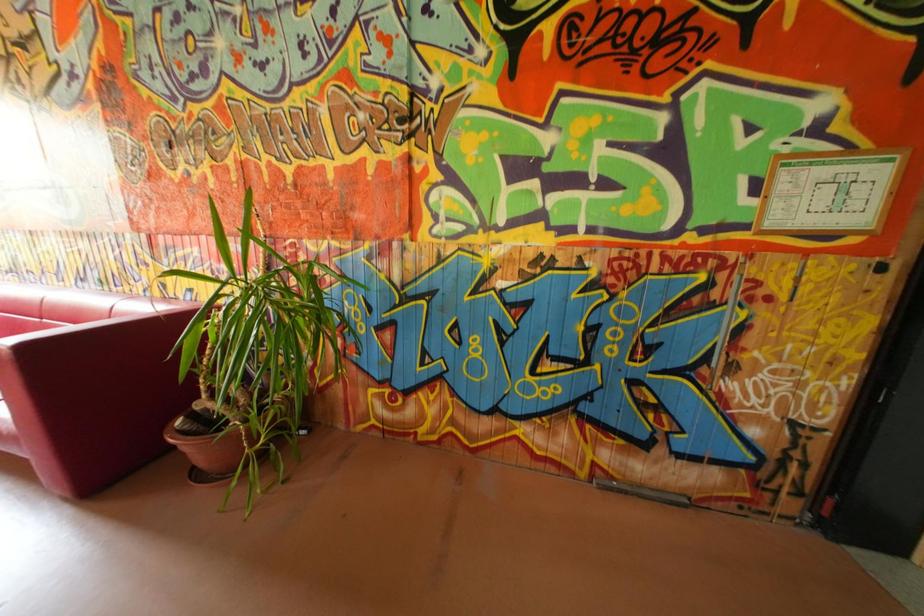
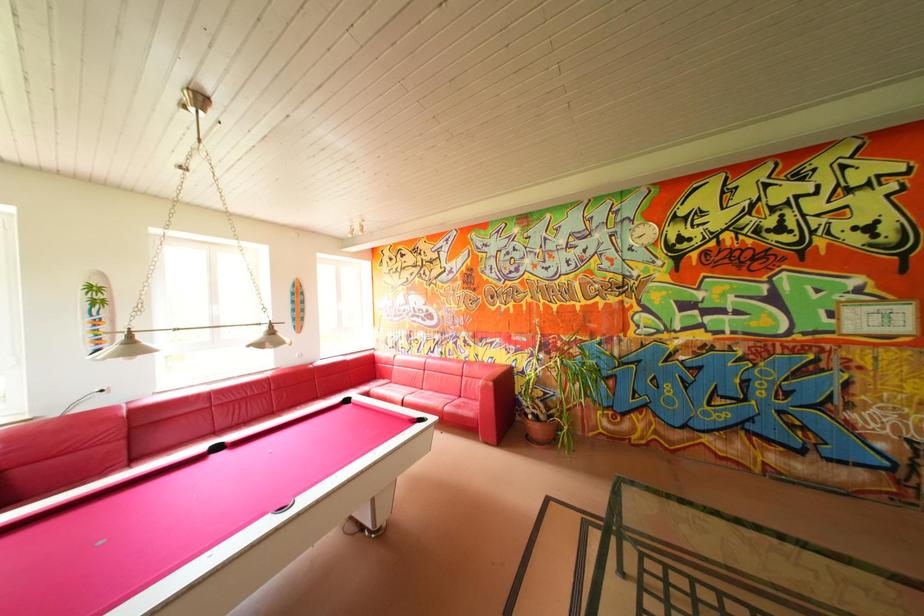
Which direction would the cameraman need to move to produce the second image?

The cameraman walked toward left, backward.